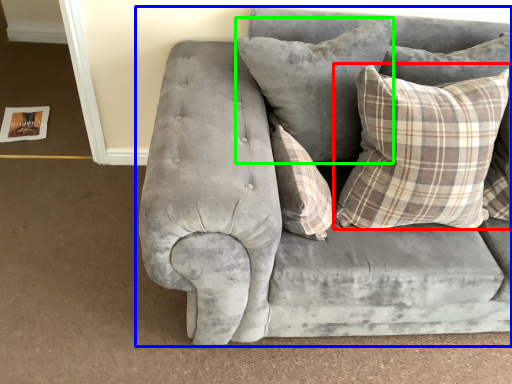
Question: Which object is positioned farthest from pillow (highlighted by a red box)? Select from studio couch (highlighted by a blue box) and pillow (highlighted by a green box).

Choices:
 (A) studio couch
 (B) pillow

Answer: (A)